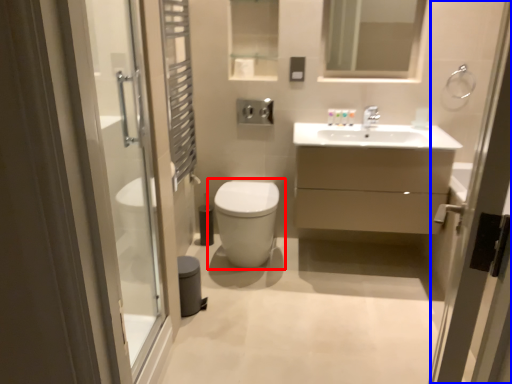
Question: Among these objects, which one is farthest to the camera, toilet (highlighted by a red box) or screen door (highlighted by a blue box)?

Choices:
 (A) toilet
 (B) screen door

Answer: (A)